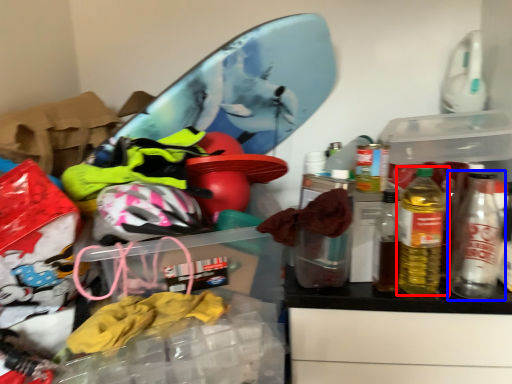
Question: Which object is further to the camera taking this photo, bottle (highlighted by a red box) or bottle (highlighted by a blue box)?

Choices:
 (A) bottle
 (B) bottle

Answer: (B)